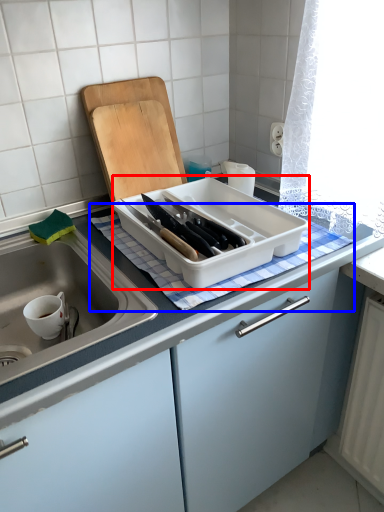
Question: Which object is closer to the camera taking this photo, kitchen appliance (highlighted by a red box) or tablecloth (highlighted by a blue box)?

Choices:
 (A) kitchen appliance
 (B) tablecloth

Answer: (A)